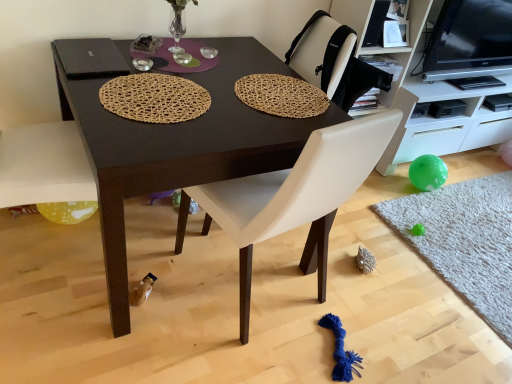
Where is `free location in front of woven natural mat at upper center, the second mat when ordered from back to front`? This screenshot has width=512, height=384. free location in front of woven natural mat at upper center, the second mat when ordered from back to front is located at coordinates (244, 124).